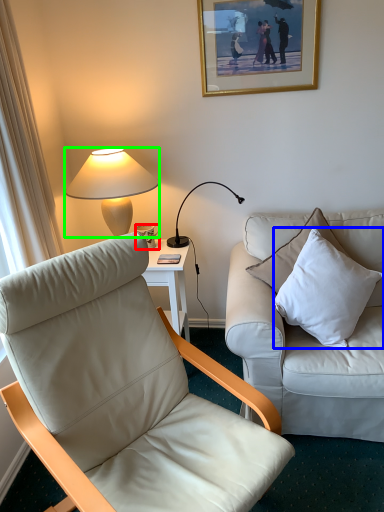
Question: Estimate the real-world distances between objects in this image. Which object is closer to coffee cup (highlighted by a red box), pillow (highlighted by a blue box) or lamp (highlighted by a green box)?

Choices:
 (A) pillow
 (B) lamp

Answer: (B)